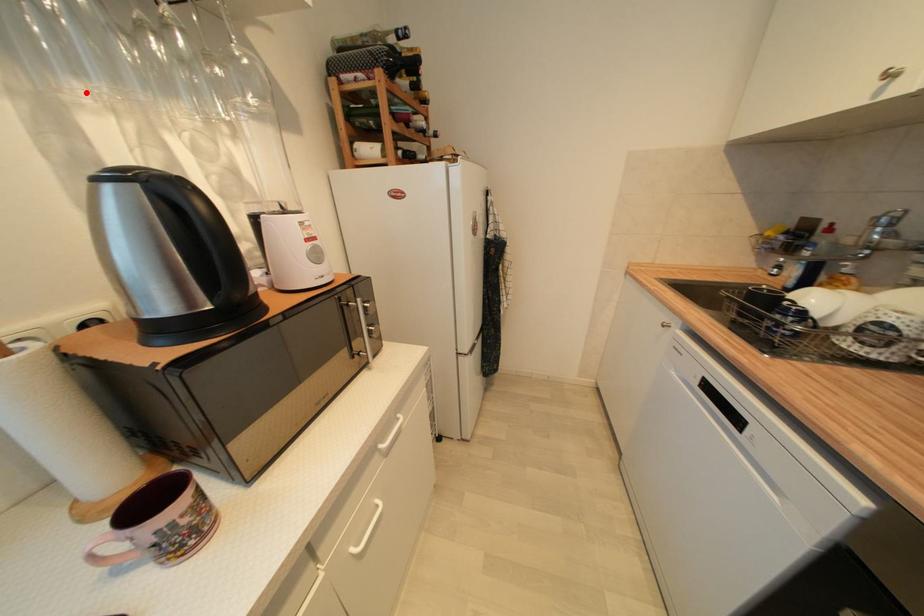
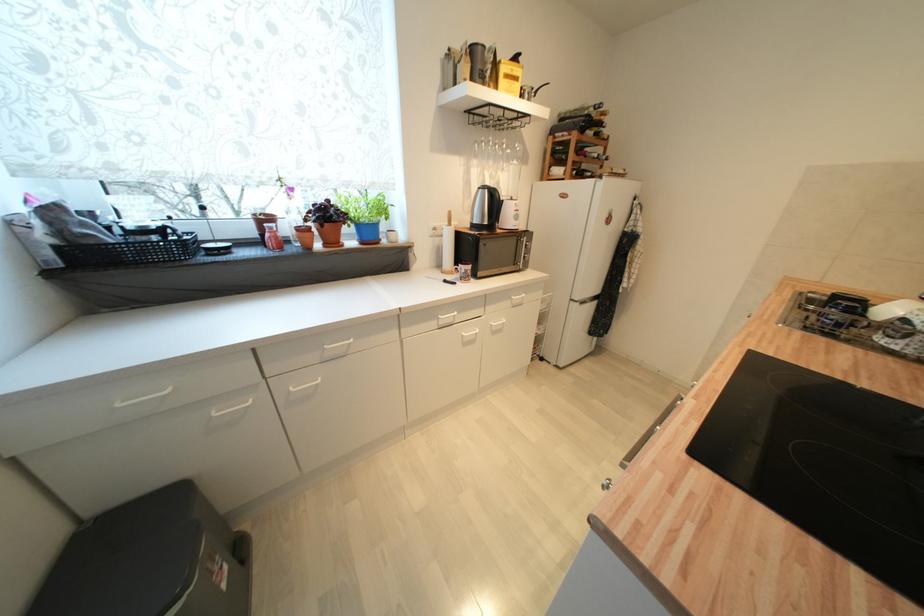
Question: I am providing you with two images of the same scene from different viewpoints. Given a red point in image1, look at the same physical point in image2. Is it:

Choices:
 (A) Closer to the viewpoint
 (B) Farther from the viewpoint

Answer: (A)